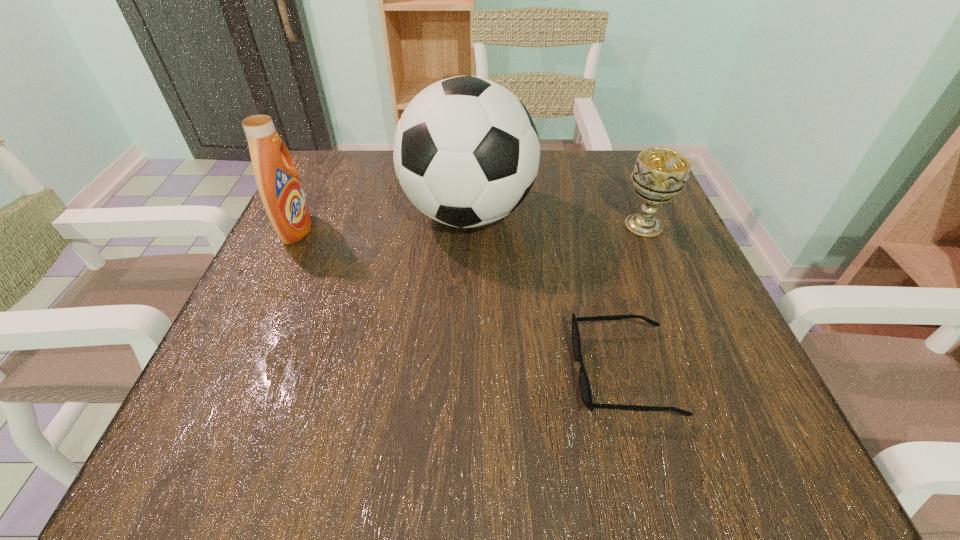
Identify the location of the third object from right to left. This screenshot has height=540, width=960. (466, 152).

Identify the location of detergent. The height and width of the screenshot is (540, 960). (277, 179).

Locate an element on the screen. the rightmost object is located at coordinates (660, 173).

Identify the location of chalice. The width and height of the screenshot is (960, 540). (660, 173).

Where is `the nearest object`? Image resolution: width=960 pixels, height=540 pixels. the nearest object is located at coordinates (585, 389).

In order to click on the shortest object in this screenshot , I will do `click(585, 389)`.

This screenshot has width=960, height=540. I want to click on free space located on the left of the soccer ball, so click(x=346, y=213).

The width and height of the screenshot is (960, 540). In order to click on vacant space located on the front-facing side of the leftmost object in this screenshot , I will do `click(469, 230)`.

Identify the location of vacant point located on the left of the second shortest object. (481, 226).

This screenshot has width=960, height=540. In order to click on vacant region located 0.270m on the front-facing side of the shortest object in this screenshot , I will do `click(394, 372)`.